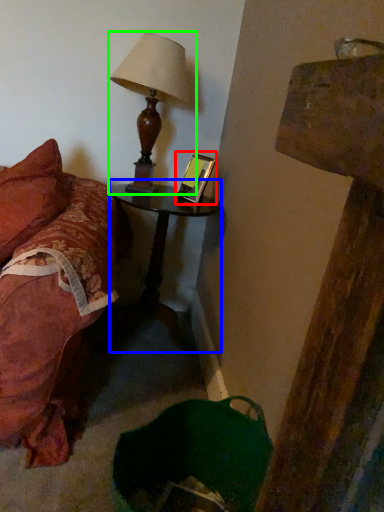
Question: Considering the real-world distances, which object is farthest from picture frame (highlighted by a red box)? nightstand (highlighted by a blue box) or lamp (highlighted by a green box)?

Choices:
 (A) nightstand
 (B) lamp

Answer: (A)